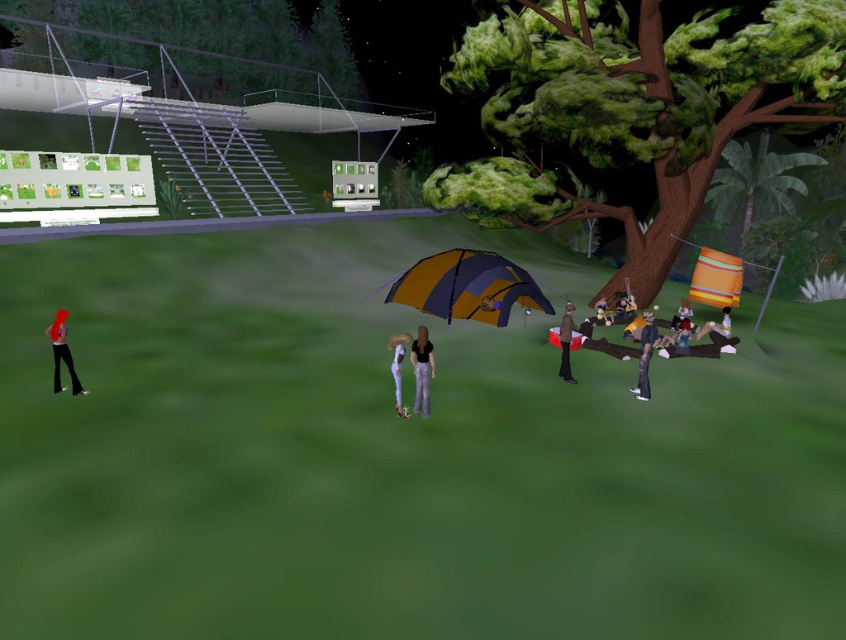
Is white matte pants at center closer to camera compared to matte black pants at center?

Yes, it is in front of matte black pants at center.

Between white matte pants at center and matte black pants at center, which one appears on the right side from the viewer's perspective?

Positioned to the right is matte black pants at center.

Where is `white matte pants at center`? This screenshot has width=846, height=640. white matte pants at center is located at coordinates (398, 365).

The height and width of the screenshot is (640, 846). In order to click on white matte pants at center in this screenshot , I will do `click(398, 365)`.

In the scene shown: Is matte yellow shirt at lower right below orange fabric bag at center right?

Yes, matte yellow shirt at lower right is below orange fabric bag at center right.

Does matte yellow shirt at lower right appear on the left side of orange fabric bag at center right?

In fact, matte yellow shirt at lower right is to the right of orange fabric bag at center right.

Find the location of a particular element. matte yellow shirt at lower right is located at coordinates 717,324.

I want to click on matte yellow shirt at lower right, so click(x=717, y=324).

Does green matte tree at center right appear on the left side of orange fabric bag at center right?

In fact, green matte tree at center right is to the right of orange fabric bag at center right.

Can you confirm if green matte tree at center right is positioned above orange fabric bag at center right?

Indeed, green matte tree at center right is positioned over orange fabric bag at center right.

Locate an element on the screen. green matte tree at center right is located at coordinates tap(632, 108).